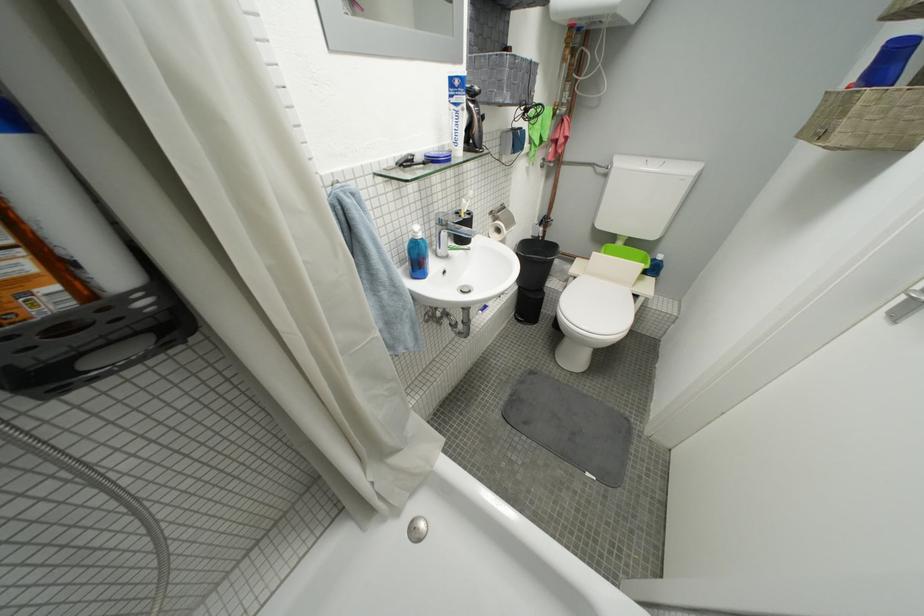
At what (x,y) coordinates should I click in order to perform the action: click on faucet handle. Please return your answer as a coordinate pair (x, y). The image size is (924, 616). Looking at the image, I should click on 447,215.